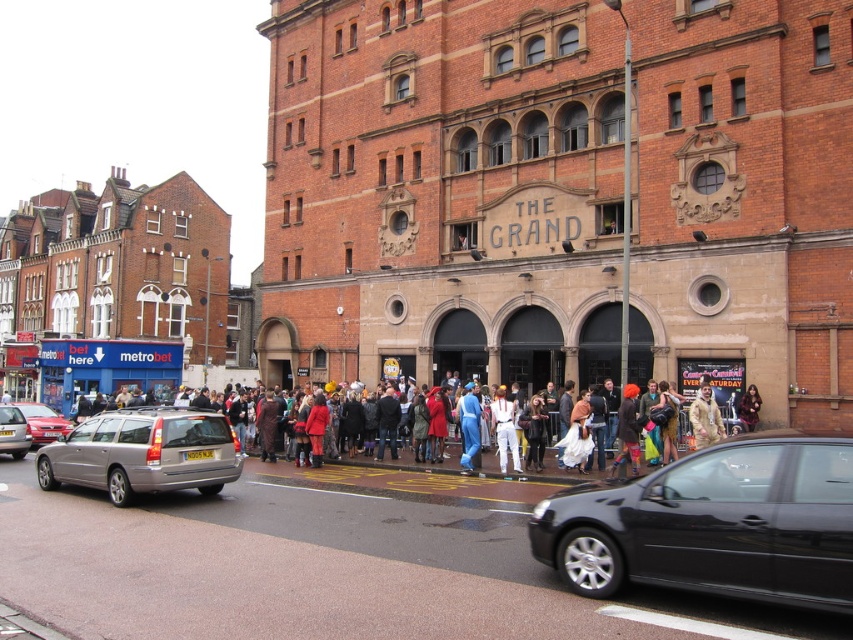
Question: Which of these objects is positioned closest to the camouflage fabric jacket at center?

Choices:
 (A) silver metallic hatchback at left
 (B) blue fabric suit at center
 (C) black metallic car at lower right

Answer: (B)

Question: Does silver metallic estate car at left come in front of velvet red dress at center?

Choices:
 (A) yes
 (B) no

Answer: (A)

Question: Can you confirm if black metallic car at lower right is positioned to the left of silver metallic estate car at left?

Choices:
 (A) no
 (B) yes

Answer: (A)

Question: Does silver metallic estate car at left have a larger size compared to white fabric pants at center?

Choices:
 (A) no
 (B) yes

Answer: (B)

Question: Which of the following is the closest to the observer?

Choices:
 (A) (473, 417)
 (B) (663, 429)
 (C) (171, 449)

Answer: (C)

Question: Among these objects, which one is farthest from the camera?

Choices:
 (A) blue fabric suit at center
 (B) silver metallic hatchback at left
 (C) velvet red dress at center

Answer: (B)